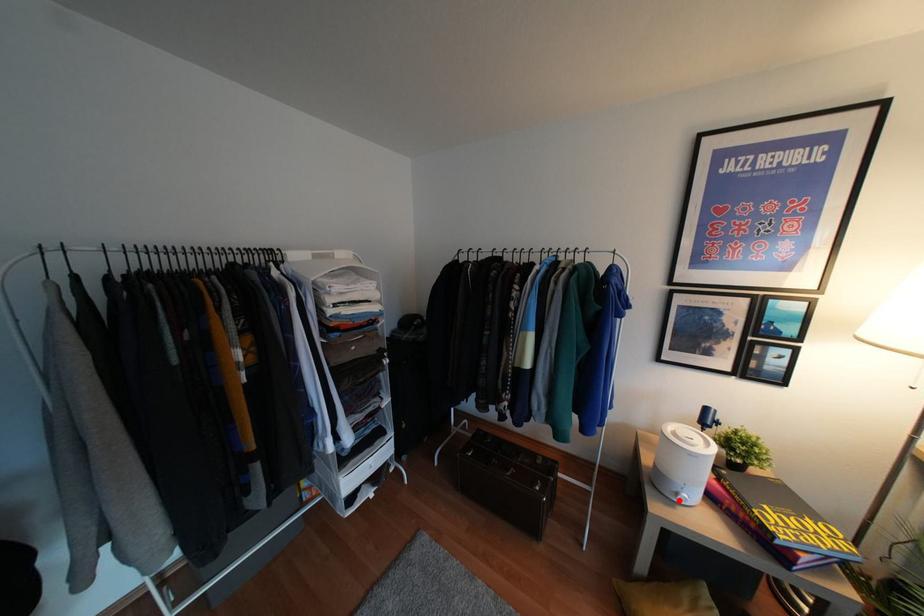
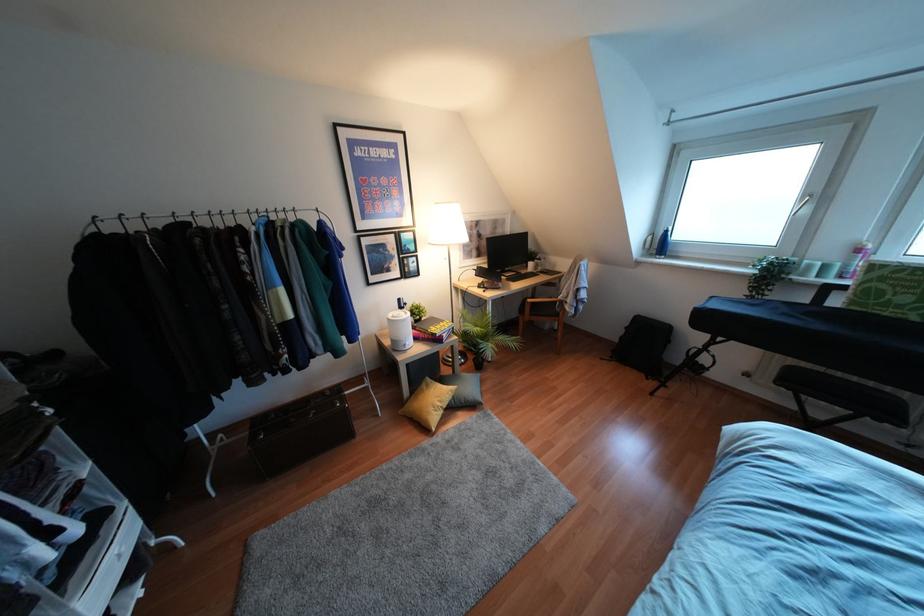
Where in the second image is the point corresponding to the highlighted location from the first image?

(407, 347)